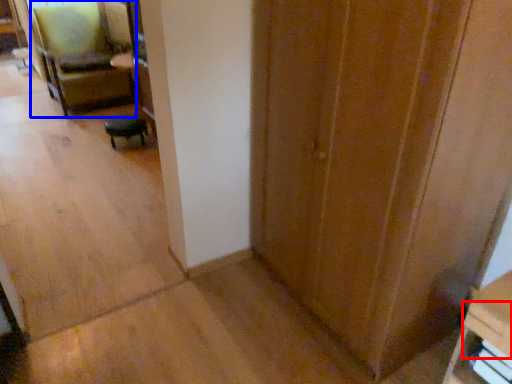
Question: Which point is further to the camera, drawer (highlighted by a red box) or chair (highlighted by a blue box)?

Choices:
 (A) drawer
 (B) chair

Answer: (B)